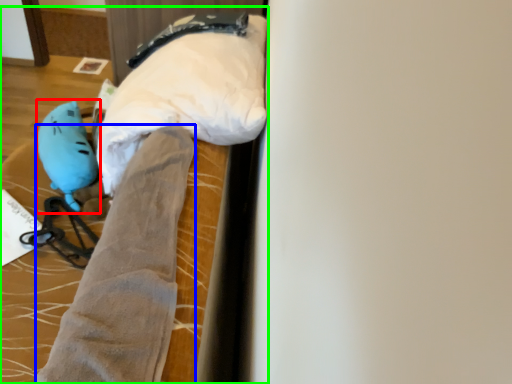
Question: Which object is positioned farthest from toy (highlighted by a red box)? Select from tight (highlighted by a blue box) and bed (highlighted by a green box).

Choices:
 (A) tight
 (B) bed

Answer: (A)